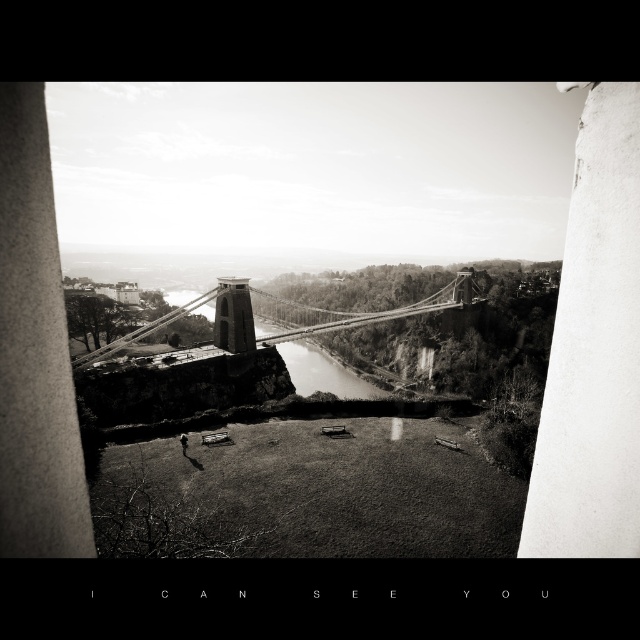
Based on the photo, you are standing on the grassy area in the foreground of the image. You want to walk from the smooth concrete pillar at left to the smooth water at center. Which direction should you move relative to the pillar?

You should move downward from the smooth concrete pillar at left to reach the smooth water at center since the pillar is above the water.

You are standing at the viewpoint where the photograph was taken. You see two points marked in the image. Which point, point (625, 388) or point (129, 342), is closer to you?

Point (625, 388) is closer to the camera than point (129, 342).

You are a surveyor planning to install a new bench between the smooth concrete pillar at left and the smooth water at center. The bench requires a flat area of 2 meters in length. Can you confirm if there is enough space between them?

The distance between the smooth concrete pillar at left and the smooth water at center is 148.19 meters, which is more than enough to accommodate a 2 meter flat area for the bench.